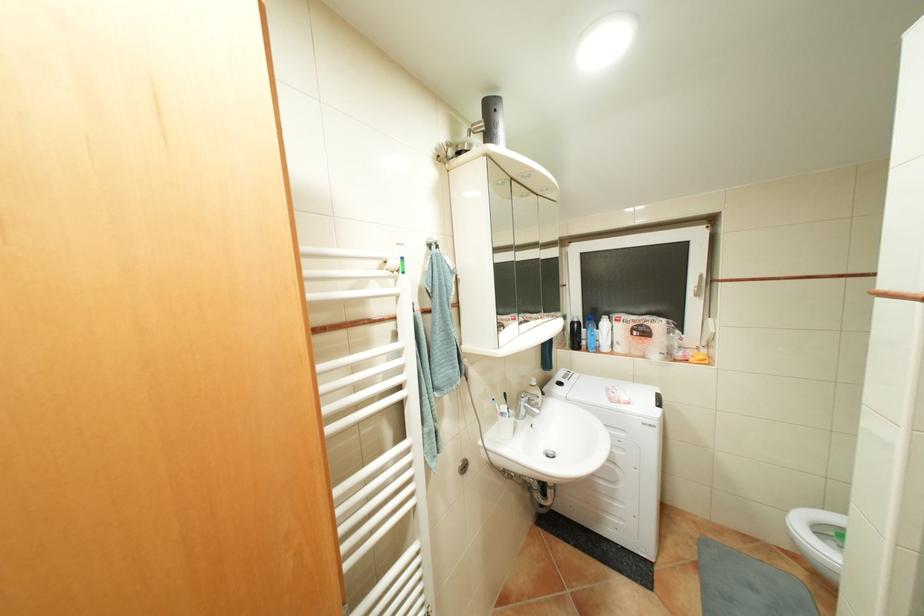
Image resolution: width=924 pixels, height=616 pixels. What do you see at coordinates (701, 290) in the screenshot?
I see `a window handle` at bounding box center [701, 290].